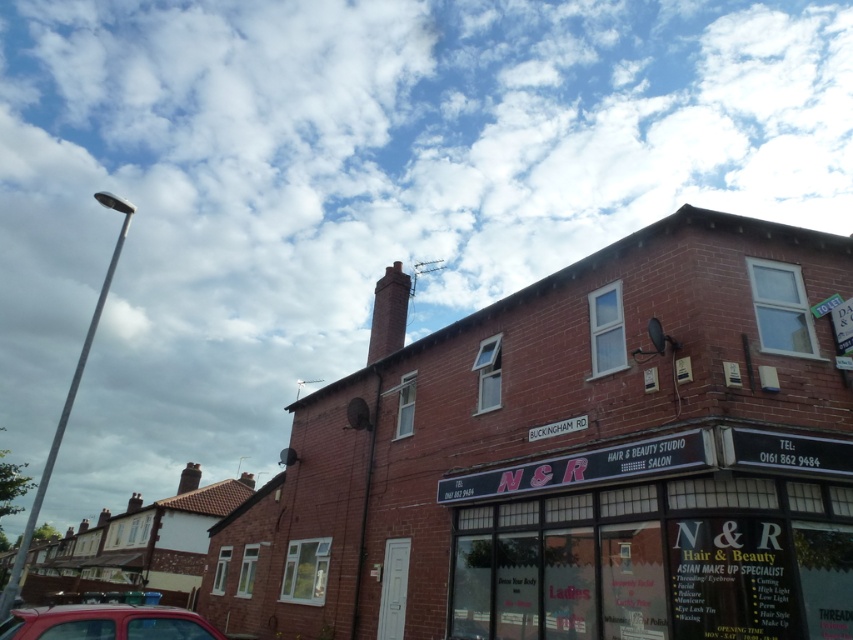
Who is more distant from viewer, (165, 632) or (399, 337)?

Point (399, 337)

Is matte red car at lower left above red brick chimney at upper center?

No, matte red car at lower left is not above red brick chimney at upper center.

Identify the location of matte red car at lower left. (106, 621).

Where is `black glass signboard at center`? black glass signboard at center is located at coordinates (659, 561).

Can you confirm if black glass signboard at center is taller than matte red car at lower left?

Yes, black glass signboard at center is taller than matte red car at lower left.

Where is `black glass signboard at center`? black glass signboard at center is located at coordinates [659, 561].

Is brick building at center positioned at the back of black glass signboard at center?

Yes, it is.

Which is below, brick building at center or black glass signboard at center?

brick building at center

At what (x,y) coordinates should I click in order to perform the action: click on brick building at center. Please return your answer as a coordinate pair (x, y). Looking at the image, I should click on (578, 460).